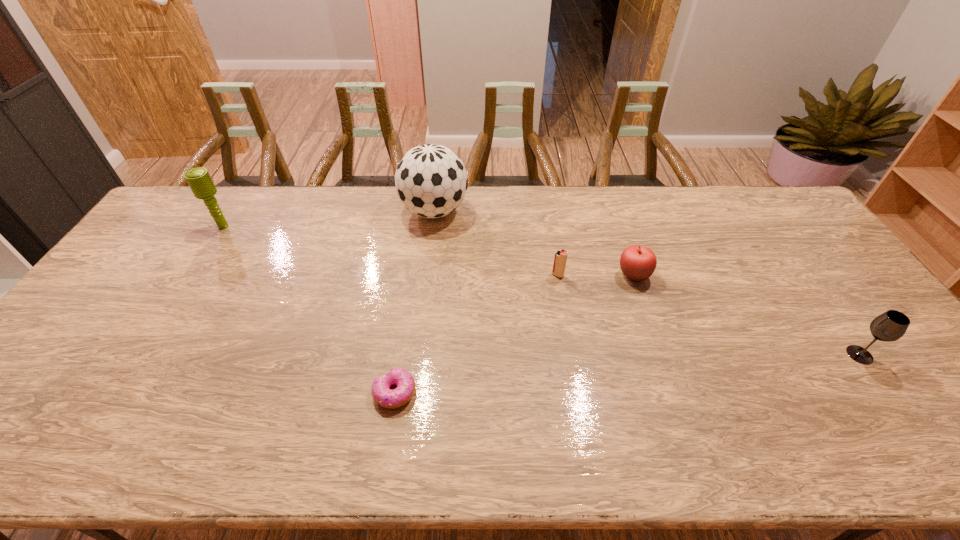
Where is `vacant area between the leftmost object and the third object from right to left`? This screenshot has height=540, width=960. vacant area between the leftmost object and the third object from right to left is located at coordinates (391, 251).

Identify the location of the second closest object to the igniter. Image resolution: width=960 pixels, height=540 pixels. (431, 180).

Select which object appears as the fifth closest to the leftmost object. Please provide its 2D coordinates. Your answer should be formatted as a tuple, i.e. [(x, y)], where the tuple contains the x and y coordinates of a point satisfying the conditions above.

[(890, 326)]

Find the location of a particular element. This screenshot has height=540, width=960. vacant space that satisfies the following two spatial constraints: 1. on the front side of the shortest object; 2. on the left side of the leftmost object is located at coordinates point(120,392).

The height and width of the screenshot is (540, 960). I want to click on vacant position in the image that satisfies the following two spatial constraints: 1. on the back side of the microphone; 2. on the right side of the soccer ball, so click(234, 211).

The width and height of the screenshot is (960, 540). Identify the location of vacant area in the image that satisfies the following two spatial constraints: 1. on the front side of the soccer ball; 2. on the left side of the apple. (427, 275).

Where is `free space that satisfies the following two spatial constraints: 1. on the front side of the leftmost object; 2. on the right side of the fifth object from left to right`? This screenshot has height=540, width=960. free space that satisfies the following two spatial constraints: 1. on the front side of the leftmost object; 2. on the right side of the fifth object from left to right is located at coordinates (193, 275).

This screenshot has height=540, width=960. Find the location of `free spot that satisfies the following two spatial constraints: 1. on the front side of the microphone; 2. on the right side of the apple`. free spot that satisfies the following two spatial constraints: 1. on the front side of the microphone; 2. on the right side of the apple is located at coordinates (193, 275).